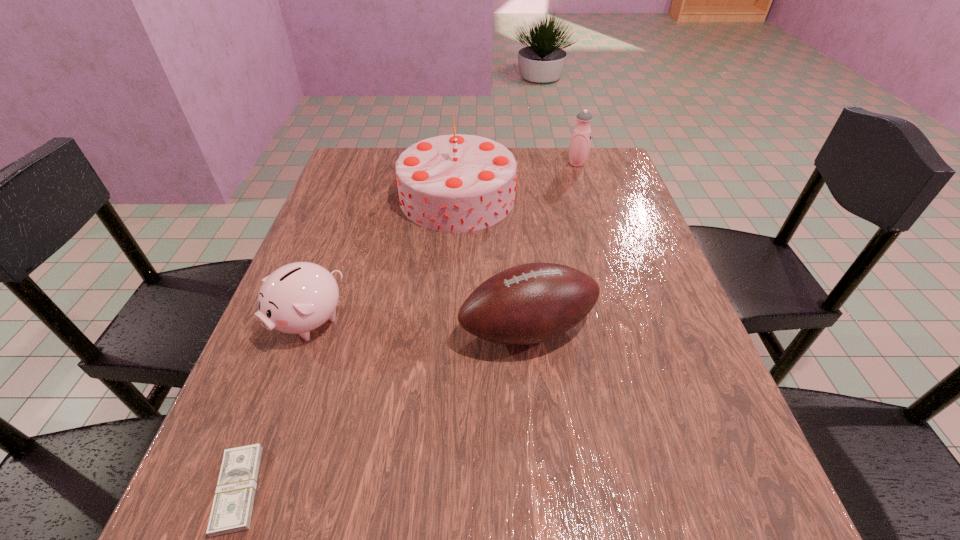
The image size is (960, 540). I want to click on free space located 0.130m on the back of the shortest object, so click(281, 376).

The width and height of the screenshot is (960, 540). What are the coordinates of `birthday cake located at the far edge` in the screenshot? It's located at (456, 183).

Locate an element on the screen. The image size is (960, 540). thermos bottle that is at the far edge is located at coordinates (579, 147).

I want to click on object at the near edge, so click(x=231, y=512).

The width and height of the screenshot is (960, 540). I want to click on piggy bank situated at the left edge, so click(x=299, y=297).

Where is `money situated at the left edge`? money situated at the left edge is located at coordinates (231, 512).

Identify the location of object that is positioned at the right edge. This screenshot has height=540, width=960. tap(579, 147).

You are a GUI agent. You are given a task and a screenshot of the screen. Output one action in this format:
    pyautogui.click(x=<x>, y=<y>)
    Task: Click on the object situated at the near left corner
    
    Given the screenshot: What is the action you would take?
    pyautogui.click(x=231, y=512)

This screenshot has width=960, height=540. In order to click on object that is positioned at the far right corner in this screenshot , I will do `click(579, 147)`.

Locate an element on the screen. The image size is (960, 540). vacant space at the far edge is located at coordinates (531, 152).